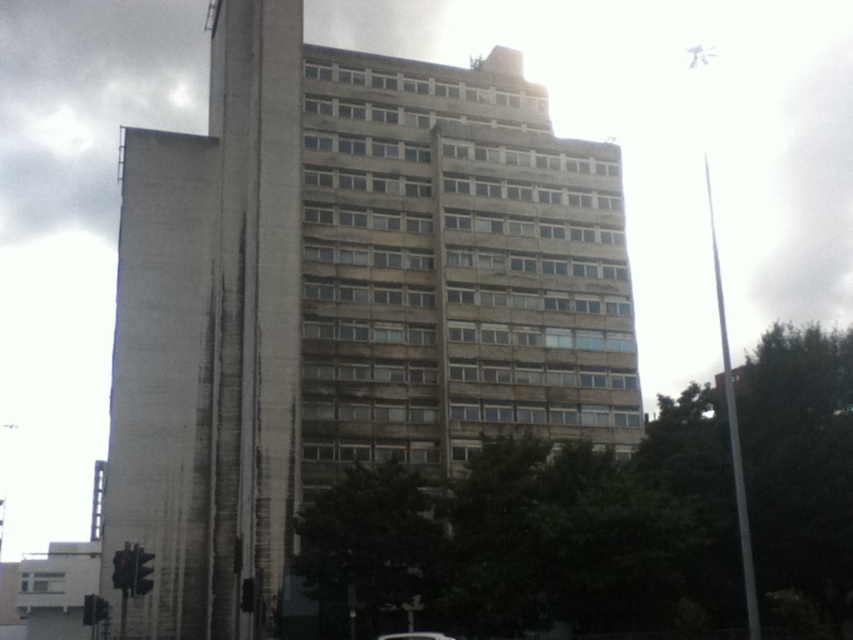
How far apart are concrete building at center and metallic silver car at lower center?

concrete building at center is 27.30 meters from metallic silver car at lower center.

Does concrete building at center have a greater width compared to metallic silver car at lower center?

Yes.

Between point (619, 260) and point (439, 637), which one is positioned in front?

Point (439, 637) is in front.

Where is `concrete building at center`? concrete building at center is located at coordinates (344, 300).